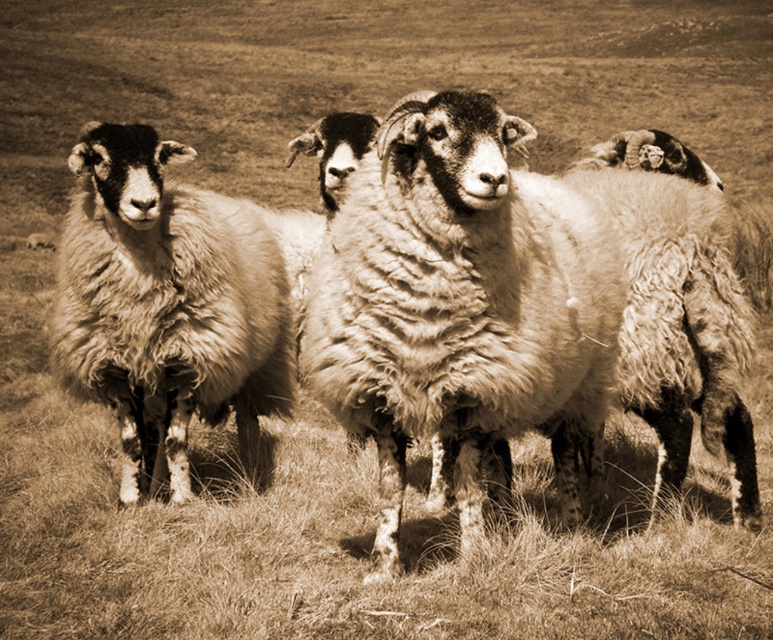
You are a photographer trying to capture a group photo of the fuzzy woolly sheep at center and the fuzzy woolly sheep at left. Which sheep should you focus on first if you want to include both in the frame without moving the camera?

The fuzzy woolly sheep at left should be focused on first because it is positioned to the left of the fuzzy woolly sheep at center, so capturing it first ensures both are in the frame without needing to adjust the camera position.

You are a farmer who needs to check the health of the fuzzy woolly sheep at center and the fuzzy woolly sheep at left. Given that your reach is 1.5 meters, can you touch both sheep without moving closer?

The distance between the fuzzy woolly sheep at center and the fuzzy woolly sheep at left is 1.54 meters, which is slightly beyond your 1.5 meter reach. You cannot touch both sheep without moving closer.